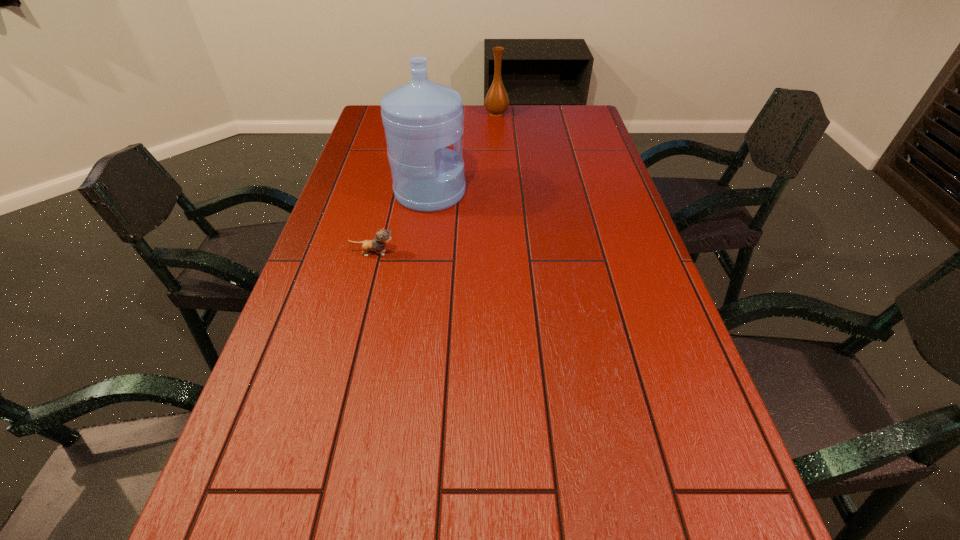
The height and width of the screenshot is (540, 960). In order to click on the second farthest object in this screenshot , I will do `click(421, 118)`.

This screenshot has width=960, height=540. What are the coordinates of `water jug` in the screenshot? It's located at (421, 118).

You are a GUI agent. You are given a task and a screenshot of the screen. Output one action in this format:
    pyautogui.click(x=<x>, y=<y>)
    Task: Click on the rightmost object
    The image size is (960, 540).
    Given the screenshot: What is the action you would take?
    pyautogui.click(x=496, y=101)

This screenshot has width=960, height=540. I want to click on the second tallest object, so click(x=496, y=101).

Identify the location of kitten. The width and height of the screenshot is (960, 540). (382, 236).

This screenshot has height=540, width=960. Identify the location of the shortest object. (382, 236).

Locate an element on the screen. This screenshot has width=960, height=540. free space located on the side of the water jug with the handle is located at coordinates (x=595, y=193).

Where is `free space located on the right of the rightmost object`? The image size is (960, 540). free space located on the right of the rightmost object is located at coordinates (526, 113).

At what (x,y) coordinates should I click in order to perform the action: click on vacant area situated 0.340m on the front-facing side of the nearest object. Please return your answer as a coordinate pair (x, y). Looking at the image, I should click on (525, 253).

Find the location of a particular element. The height and width of the screenshot is (540, 960). object that is positioned at the far edge is located at coordinates (496, 101).